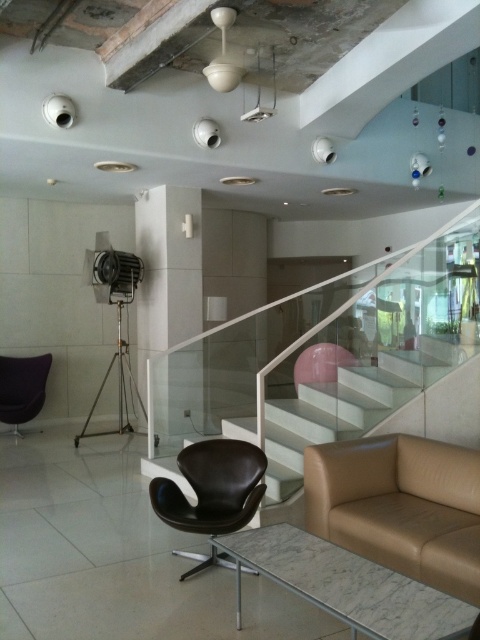
Question: Is white glossy pillar at center behind velvet black chair at left?

Choices:
 (A) no
 (B) yes

Answer: (A)

Question: Does white glossy pillar at center appear over black leather chair at center?

Choices:
 (A) yes
 (B) no

Answer: (A)

Question: Among these objects, which one is farthest from the camera?

Choices:
 (A) tan leather couch at lower right
 (B) black leather chair at center
 (C) velvet black chair at left
 (D) white glossy pillar at center

Answer: (C)

Question: Which point is closer to the camera?

Choices:
 (A) white glossy pillar at center
 (B) tan leather couch at lower right
 (C) black leather chair at center

Answer: (B)

Question: Does tan leather couch at lower right appear under velvet black chair at left?

Choices:
 (A) yes
 (B) no

Answer: (A)

Question: Which object is farther from the camera taking this photo?

Choices:
 (A) tan leather couch at lower right
 (B) velvet black chair at left
 (C) black leather chair at center
 (D) white glossy pillar at center

Answer: (B)